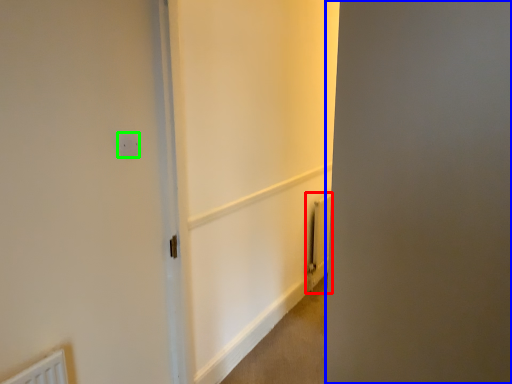
Question: Estimate the real-world distances between objects in this image. Which object is farther from radiator (highlighted by a red box), screen door (highlighted by a blue box) or electric outlet (highlighted by a green box)?

Choices:
 (A) screen door
 (B) electric outlet

Answer: (A)